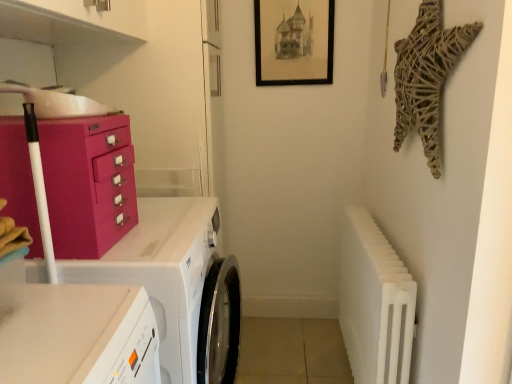
Question: Can you confirm if white glossy washing machine at lower left is positioned to the right of white ribbed radiator at right?

Choices:
 (A) yes
 (B) no

Answer: (B)

Question: Can you confirm if white glossy washing machine at lower left is wider than white ribbed radiator at right?

Choices:
 (A) no
 (B) yes

Answer: (B)

Question: Considering the relative sizes of white glossy washing machine at lower left and white ribbed radiator at right in the image provided, is white glossy washing machine at lower left taller than white ribbed radiator at right?

Choices:
 (A) yes
 (B) no

Answer: (A)

Question: From a real-world perspective, is white glossy washing machine at lower left located beneath white ribbed radiator at right?

Choices:
 (A) no
 (B) yes

Answer: (A)

Question: From the image's perspective, does white glossy washing machine at lower left appear lower than white ribbed radiator at right?

Choices:
 (A) yes
 (B) no

Answer: (B)

Question: Does point (39, 253) appear closer or farther from the camera than point (270, 84)?

Choices:
 (A) farther
 (B) closer

Answer: (B)

Question: Considering the relative positions of matte pink cabinet at left and black matte picture frame at upper center in the image provided, is matte pink cabinet at left to the left or to the right of black matte picture frame at upper center?

Choices:
 (A) right
 (B) left

Answer: (B)

Question: Is matte pink cabinet at left situated inside black matte picture frame at upper center or outside?

Choices:
 (A) outside
 (B) inside

Answer: (A)

Question: In terms of size, does matte pink cabinet at left appear bigger or smaller than black matte picture frame at upper center?

Choices:
 (A) big
 (B) small

Answer: (A)

Question: In terms of height, does white glossy washing machine at lower left look taller or shorter compared to white ribbed radiator at right?

Choices:
 (A) short
 (B) tall

Answer: (B)

Question: Considering the positions of point (212, 200) and point (342, 322), is point (212, 200) closer or farther from the camera than point (342, 322)?

Choices:
 (A) farther
 (B) closer

Answer: (B)

Question: Would you say white glossy washing machine at lower left is to the left or to the right of white ribbed radiator at right in the picture?

Choices:
 (A) left
 (B) right

Answer: (A)

Question: Looking at the image, does white glossy washing machine at lower left seem bigger or smaller compared to white ribbed radiator at right?

Choices:
 (A) big
 (B) small

Answer: (A)

Question: Considering the positions of white glossy washing machine at lower left and matte pink cabinet at left in the image, is white glossy washing machine at lower left wider or thinner than matte pink cabinet at left?

Choices:
 (A) thin
 (B) wide

Answer: (B)

Question: In the image, is white glossy washing machine at lower left positioned in front of or behind matte pink cabinet at left?

Choices:
 (A) front
 (B) behind

Answer: (B)